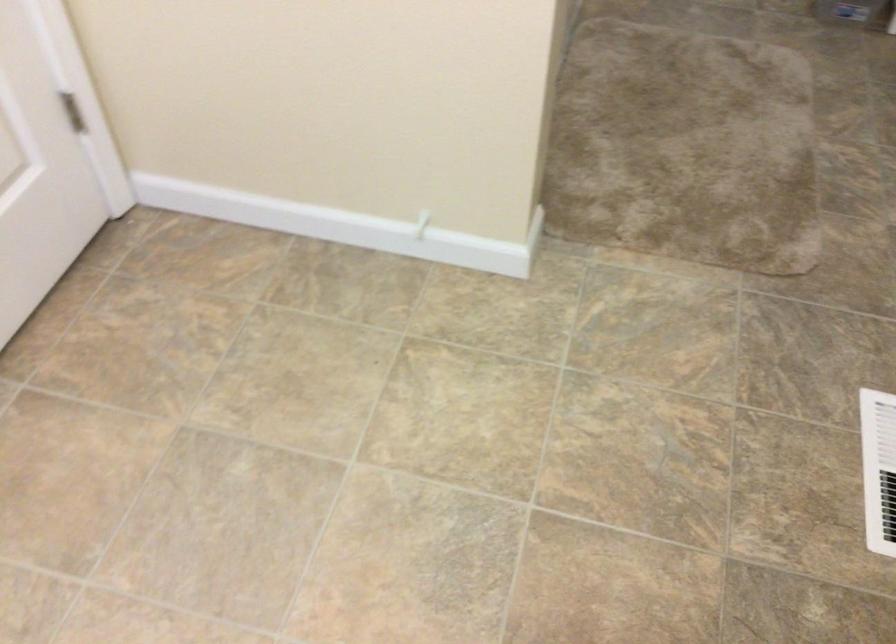
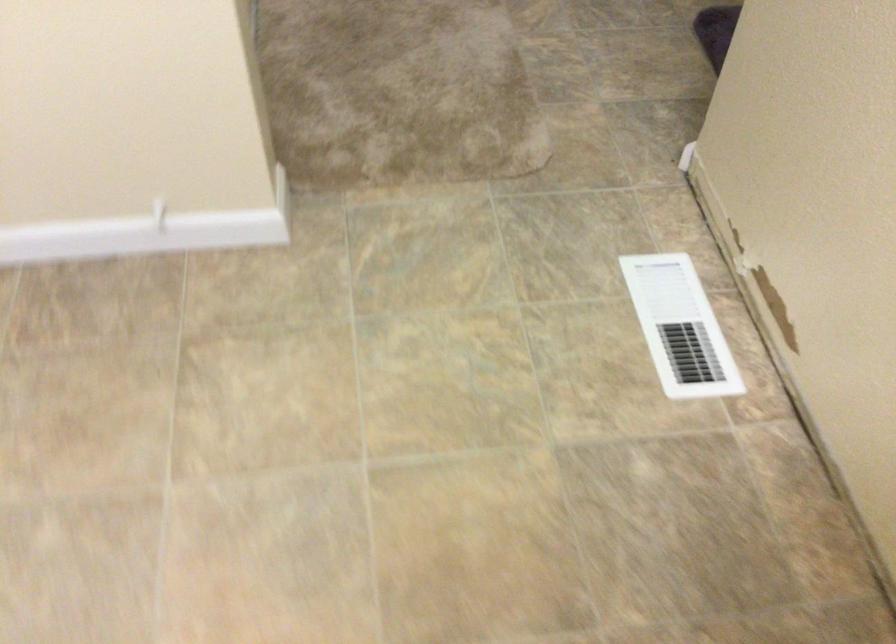
Question: The camera is either moving clockwise (left) or counter-clockwise (right) around the object. The first image is from the beginning of the video and the second image is from the end. Is the camera moving left or right when shooting the video?

Choices:
 (A) Left
 (B) Right

Answer: (A)